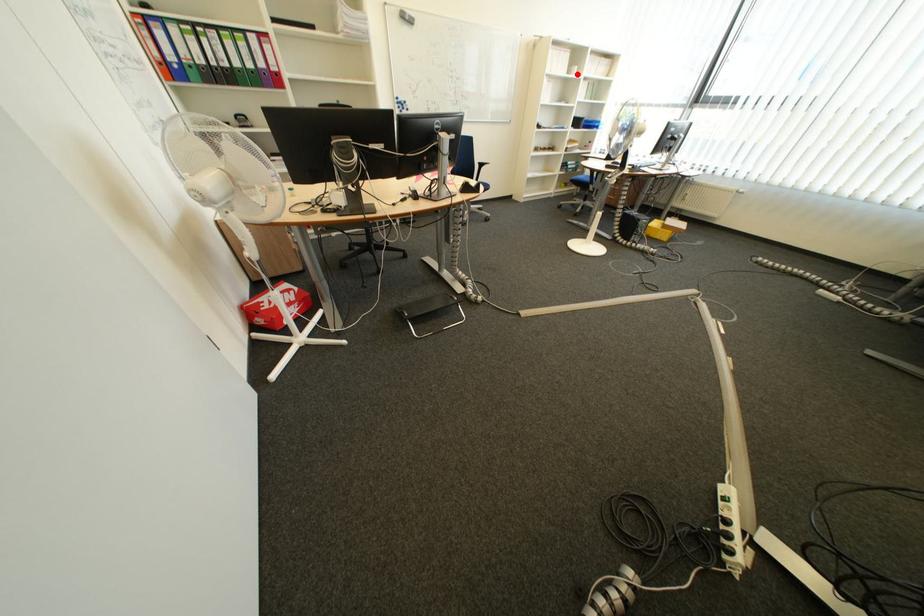
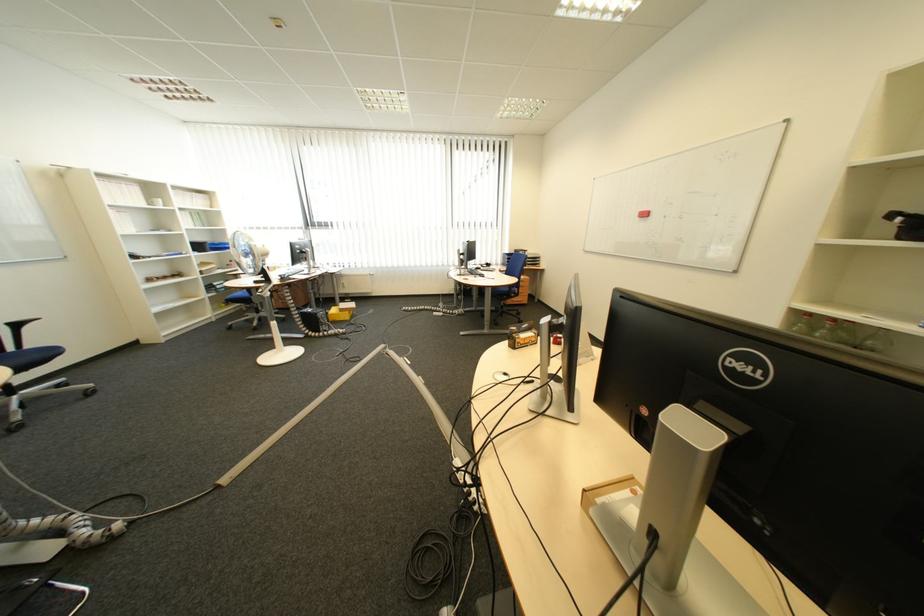
Find the pixel in the second image that matches the highlighted location in the first image.

(155, 206)